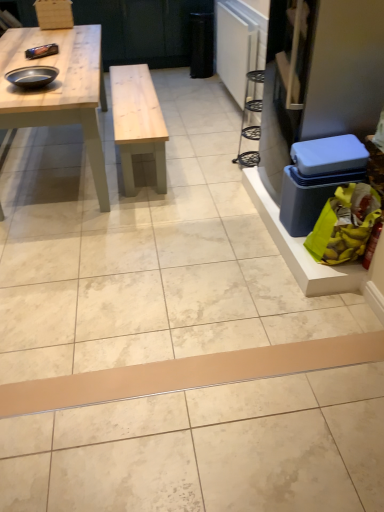
In order to click on free space in front of light wood table at upper left in this screenshot , I will do `click(123, 265)`.